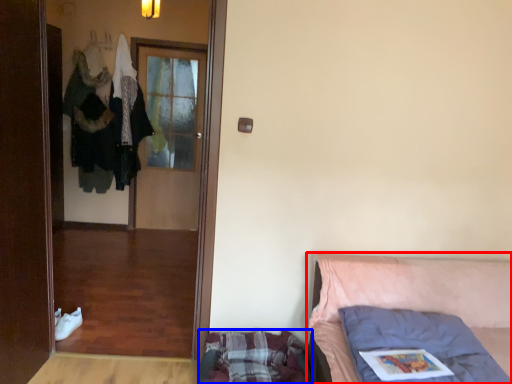
Question: Which point is closer to the camera, furniture (highlighted by a red box) or mattress (highlighted by a blue box)?

Choices:
 (A) furniture
 (B) mattress

Answer: (A)